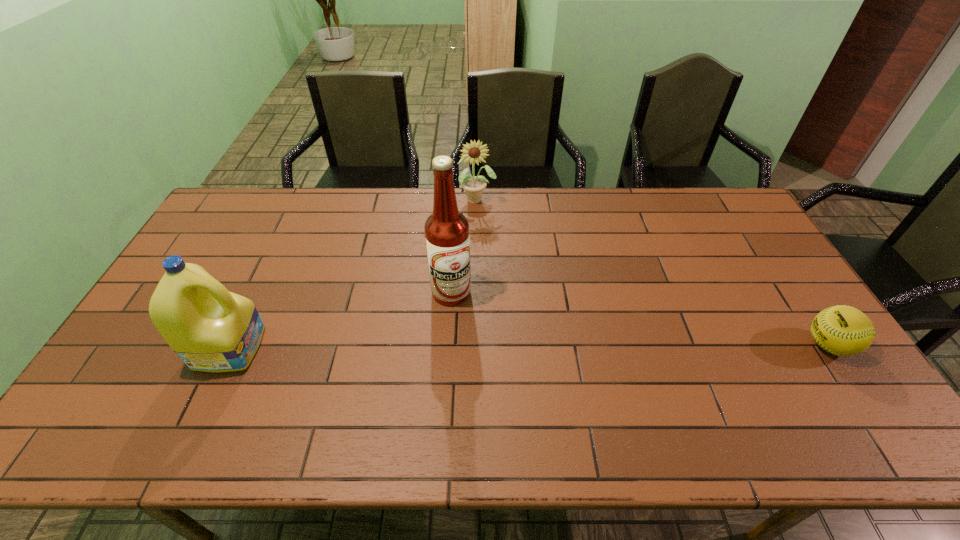
In order to click on free spot on the desktop that is between the detergent and the rightmost object and is positioned on the label side of the third nearest object in this screenshot , I will do `click(510, 346)`.

Where is `free space on the desktop that is between the third shortest object and the softball and is positioned on the front-facing side of the farthest object`? This screenshot has height=540, width=960. free space on the desktop that is between the third shortest object and the softball and is positioned on the front-facing side of the farthest object is located at coordinates (490, 346).